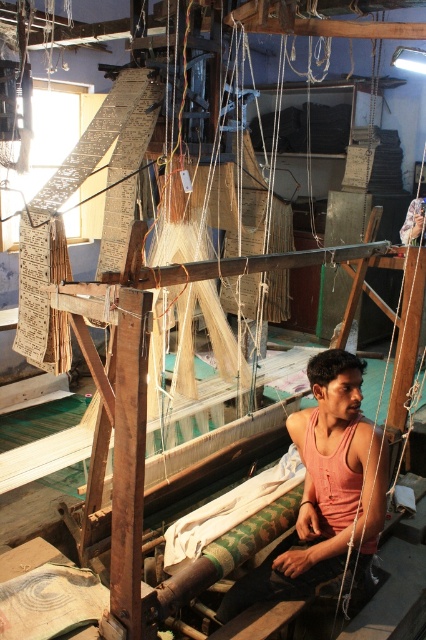
Question: Is pink cotton tank top at center positioned in front of green woven cloth at center?

Choices:
 (A) no
 (B) yes

Answer: (B)

Question: Among these objects, which one is farthest from the camera?

Choices:
 (A) green woven cloth at center
 (B) pink cotton tank top at center

Answer: (A)

Question: Can you confirm if pink cotton tank top at center is positioned to the left of green woven cloth at center?

Choices:
 (A) no
 (B) yes

Answer: (A)

Question: Is pink cotton tank top at center further to camera compared to green woven cloth at center?

Choices:
 (A) no
 (B) yes

Answer: (A)

Question: Which point appears farthest from the camera in this image?

Choices:
 (A) (284, 474)
 (B) (244, 586)

Answer: (A)

Question: Which object is farther from the camera taking this photo?

Choices:
 (A) pink cotton tank top at center
 (B) green woven cloth at center

Answer: (B)